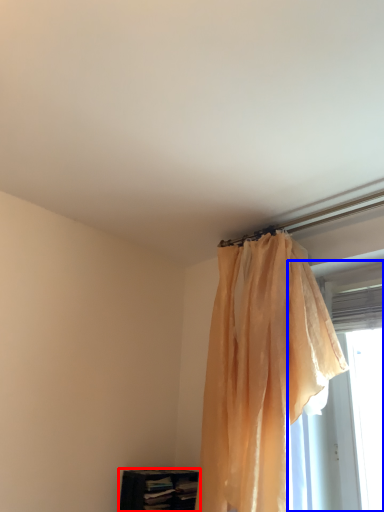
Question: Among these objects, which one is nearest to the camera, furniture (highlighted by a red box) or window (highlighted by a blue box)?

Choices:
 (A) furniture
 (B) window

Answer: (B)